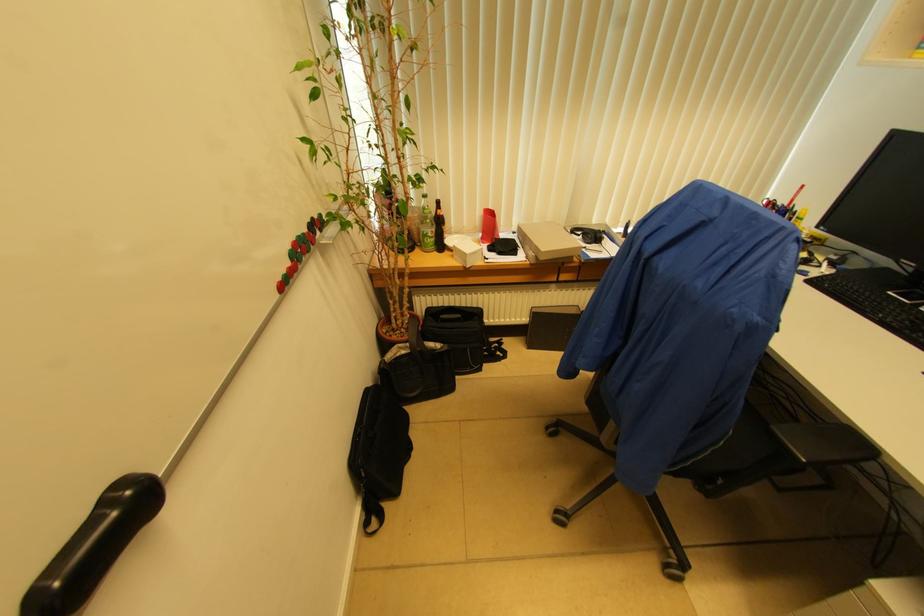
Find where to rest the chair armest. Please return your answer as a coordinate pair (x, y).

(824, 443)